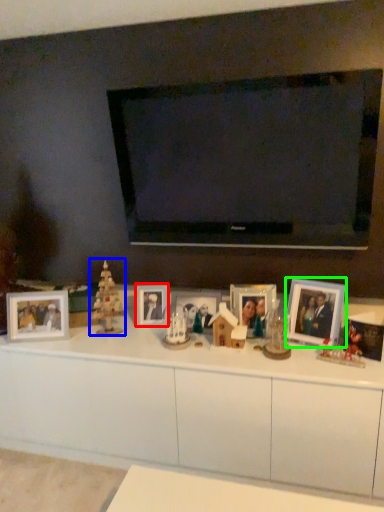
Question: Which is farther away from picture frame (highlighted by a red box)? christmas decoration (highlighted by a blue box) or picture frame (highlighted by a green box)?

Choices:
 (A) christmas decoration
 (B) picture frame

Answer: (B)